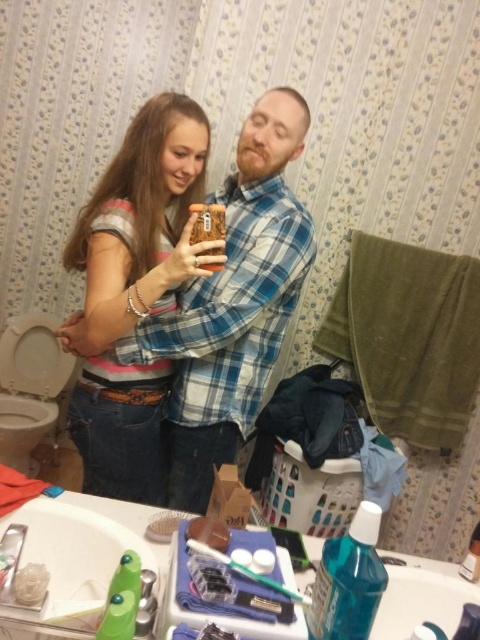
Which is behind, point (149, 285) or point (379, 528)?

Point (149, 285)

Is point (140, 218) closer to viewer compared to point (367, 580)?

No, it is not.

Locate an element on the screen. striped cotton shirt at center is located at coordinates (132, 291).